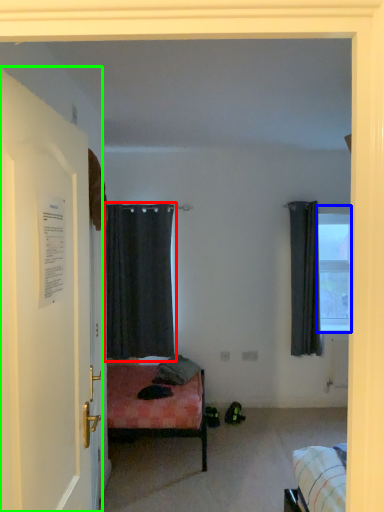
Question: Based on their relative distances, which object is nearer to curtain (highlighted by a red box)? Choose from window (highlighted by a blue box) and door (highlighted by a green box).

Choices:
 (A) window
 (B) door

Answer: (A)